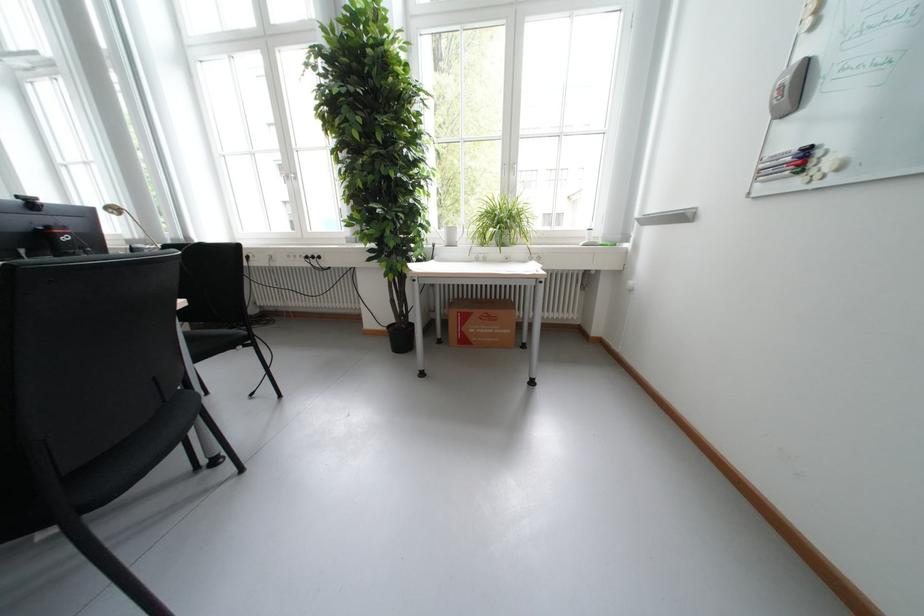
Find where to grasp the whiteboard marker. Please return your answer as a coordinate pair (x, y).

(774, 161)